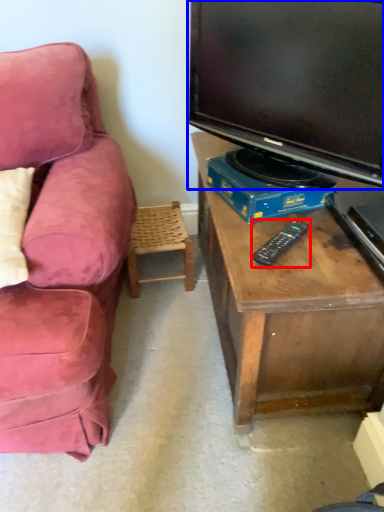
Question: Which of the following is the farthest to the observer, remote (highlighted by a red box) or television (highlighted by a blue box)?

Choices:
 (A) remote
 (B) television

Answer: (A)